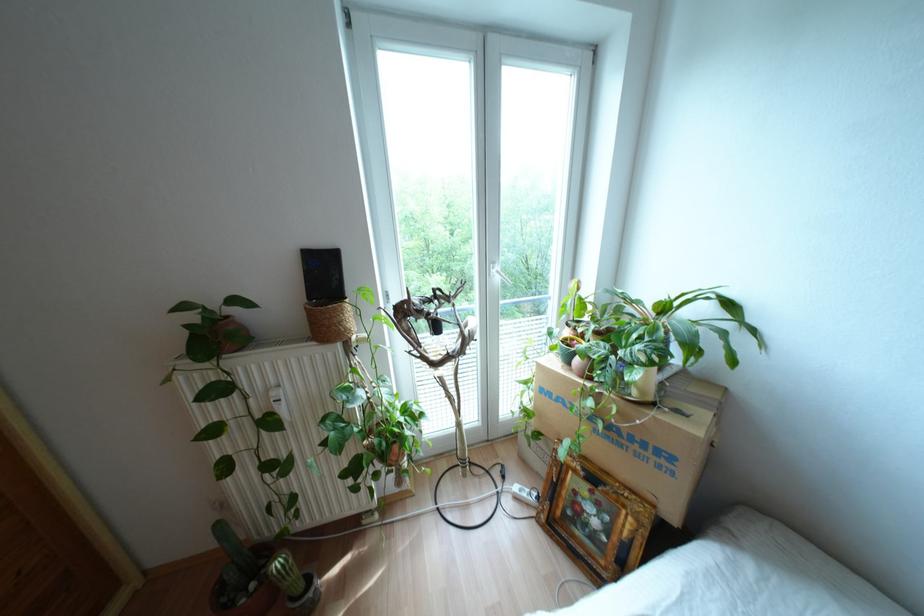
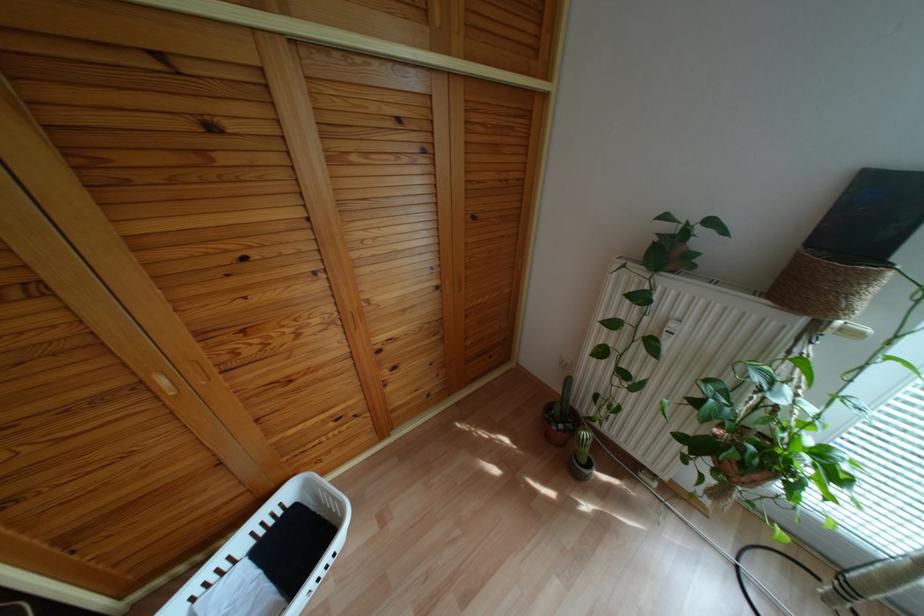
The point at (350,323) is marked in the first image. Where is the corresponding point in the second image?

(861, 302)